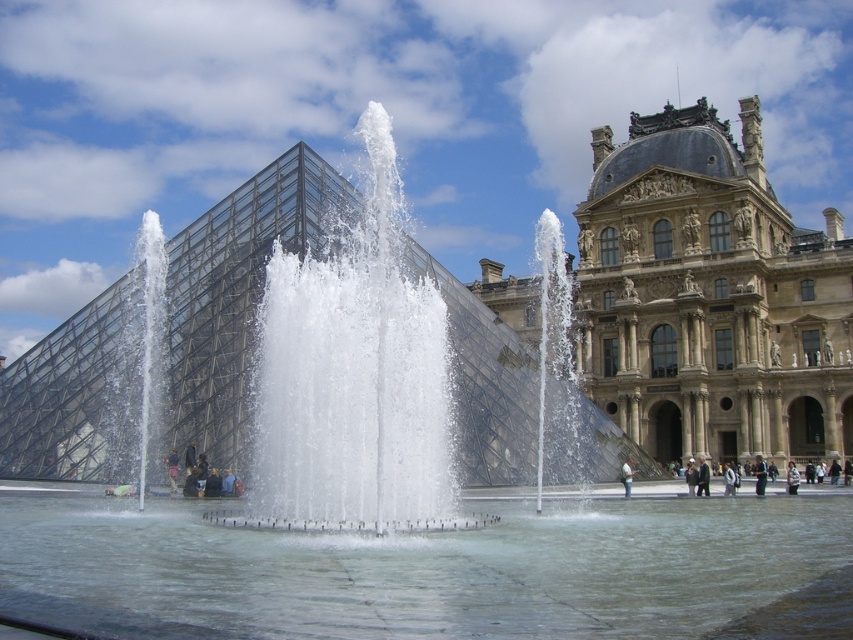
Question: Can you confirm if dark gray stone people at lower right is wider than dark blue jeans at center?

Choices:
 (A) no
 (B) yes

Answer: (B)

Question: Which point is farther to the camera?

Choices:
 (A) (733, 492)
 (B) (271, 369)

Answer: (A)

Question: Which point is closer to the camera?

Choices:
 (A) clear water at center
 (B) dark blue jeans at center
 (C) light brown leather jacket at center
 (D) golden stone palace at center

Answer: (A)

Question: Which object is closer to the camera taking this photo?

Choices:
 (A) white textured sweater at center
 (B) dark gray stone people at lower right
 (C) dark blue jeans at center
 (D) light brown leather jacket at center

Answer: (B)

Question: Does golden stone palace at center appear on the right side of dark gray stone people at lower right?

Choices:
 (A) no
 (B) yes

Answer: (A)

Question: Does dark gray stone people at lower right appear under light brown leather jacket at center?

Choices:
 (A) yes
 (B) no

Answer: (B)